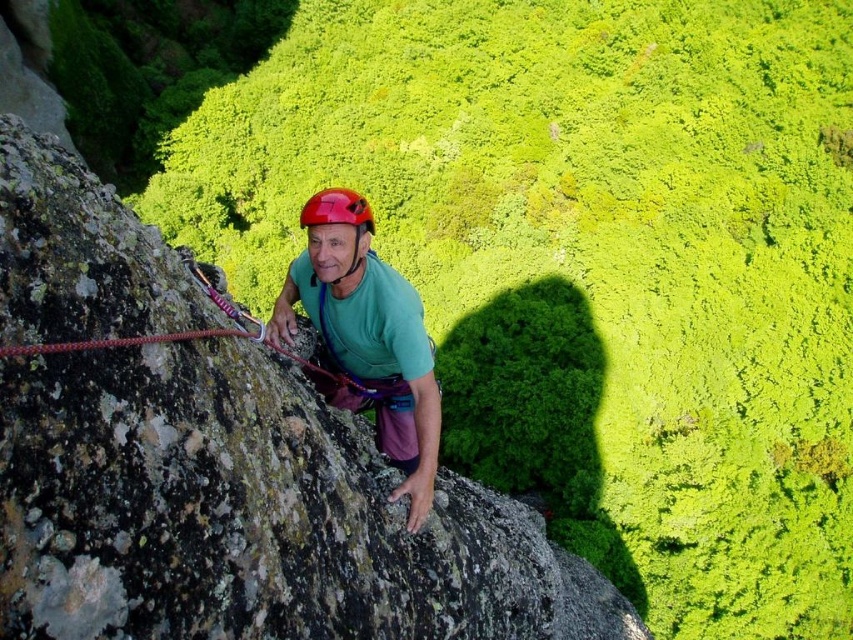
Which of these two, green matte helmet at center or shiny red helmet at center, stands taller?

With more height is shiny red helmet at center.

Which of these two, green matte helmet at center or shiny red helmet at center, stands shorter?

green matte helmet at center

What do you see at coordinates (367, 336) in the screenshot? The image size is (853, 640). I see `green matte helmet at center` at bounding box center [367, 336].

This screenshot has height=640, width=853. In order to click on green matte helmet at center in this screenshot , I will do tap(367, 336).